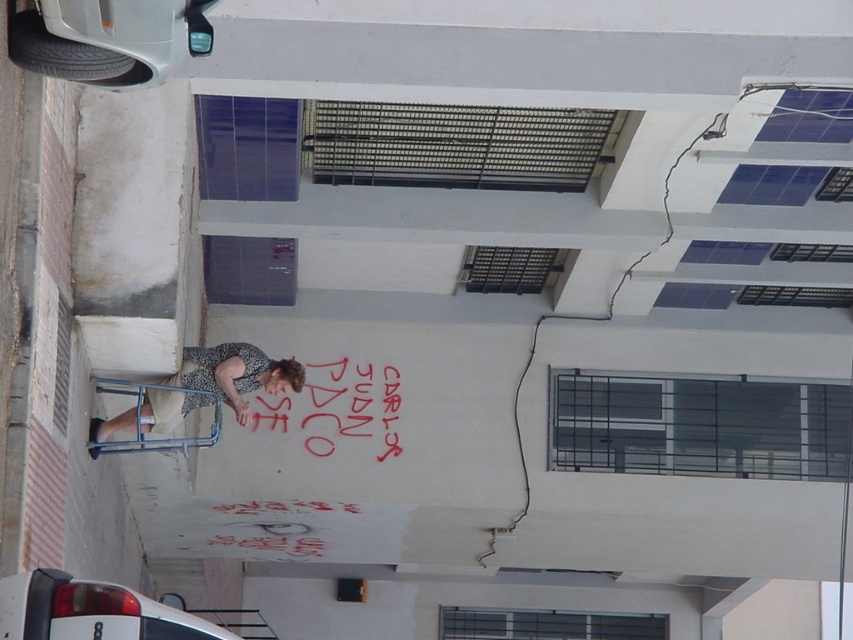
Can you confirm if beige fabric dress at lower left is thinner than red chalk graffiti at center?

In fact, beige fabric dress at lower left might be wider than red chalk graffiti at center.

Measure the distance between point (215,364) and camera.

They are 24.07 meters apart.

I want to click on beige fabric dress at lower left, so click(202, 388).